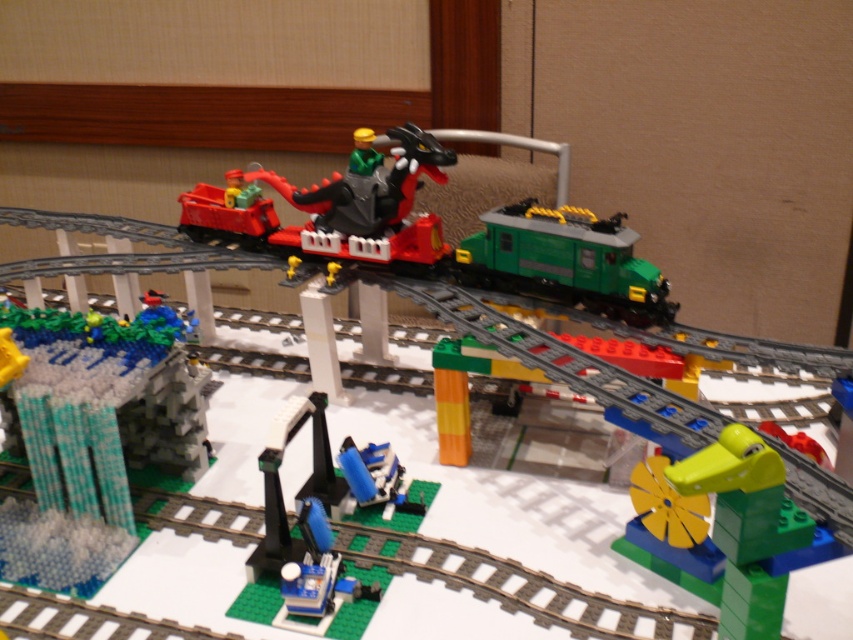
Based on the photo, you are a toy boat that is 12 inches long. You want to sail from the translucent blue water at lower left to the yellow windmill. Can you fit through the space between the two objects?

The distance between the translucent blue water at lower left and the yellow windmill is 30.24 inches, so yes, the boat can fit through the space since it is wider than the boat.

You are a LEGO train engineer looking at the scene. You need to place a new LEGO boat near the translucent blue water at lower left. Where exactly should you place it?

The translucent blue water at lower left is located at point (94,435), so you should place the new LEGO boat near those coordinates.